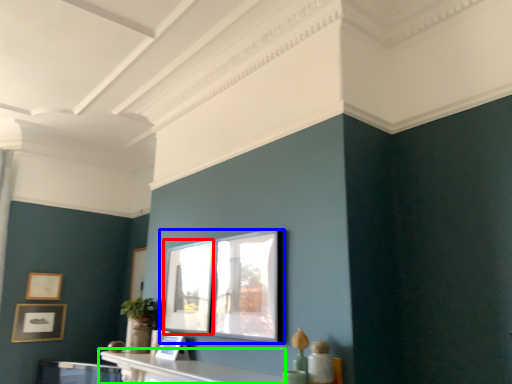
Question: Which is nearer to the window (highlighted by a red box)? picture frame (highlighted by a blue box) or table (highlighted by a green box).

Choices:
 (A) picture frame
 (B) table

Answer: (A)